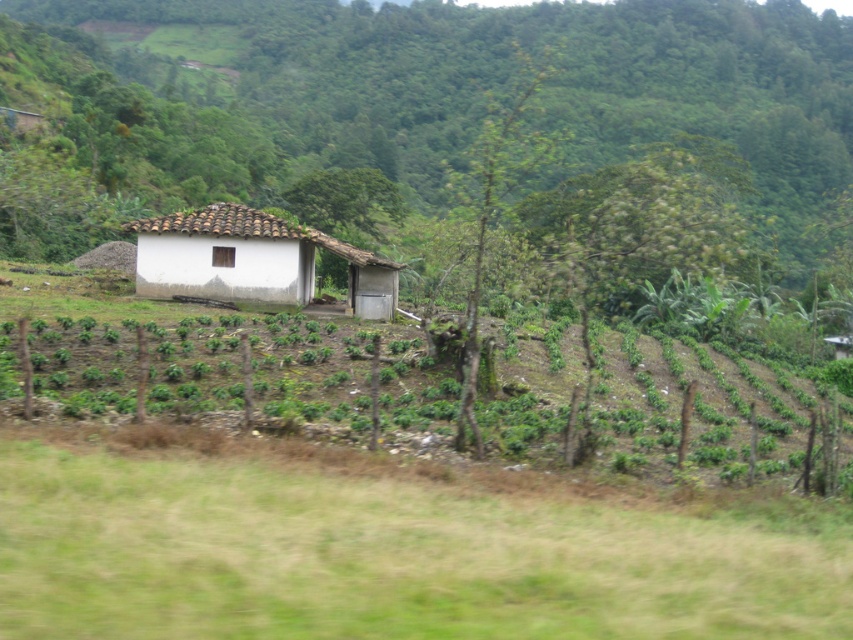
Is white matte house at center closer to camera compared to green leafy plants at center?

No, it is behind green leafy plants at center.

Does white matte house at center have a larger size compared to green leafy plants at center?

Indeed, white matte house at center has a larger size compared to green leafy plants at center.

This screenshot has width=853, height=640. Describe the element at coordinates (479, 88) in the screenshot. I see `white matte house at center` at that location.

Locate an element on the screen. Image resolution: width=853 pixels, height=640 pixels. white matte house at center is located at coordinates (479, 88).

Is point (173, 179) more distant than point (187, 211)?

Yes, it is.

Can you confirm if white matte house at center is shorter than white clay hut at center?

No, white matte house at center is not shorter than white clay hut at center.

The width and height of the screenshot is (853, 640). I want to click on white matte house at center, so pyautogui.click(x=479, y=88).

Which of these two, white matte house at center or transparent glass window at center, stands taller?

white matte house at center

Is white matte house at center above transparent glass window at center?

Indeed, white matte house at center is positioned over transparent glass window at center.

Between point (683, 116) and point (221, 248), which one is positioned in front?

Positioned in front is point (221, 248).

Locate an element on the screen. white matte house at center is located at coordinates (479, 88).